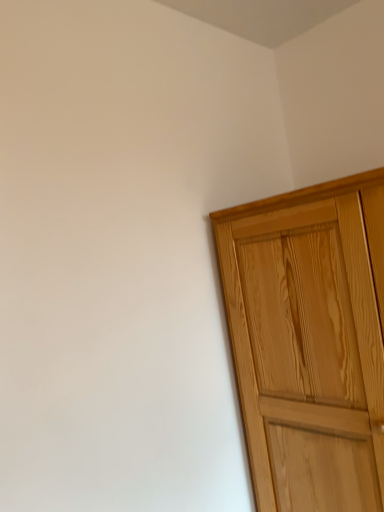
Question: Should I look upward or downward to see natural wood cupboard at right?

Choices:
 (A) down
 (B) up

Answer: (A)